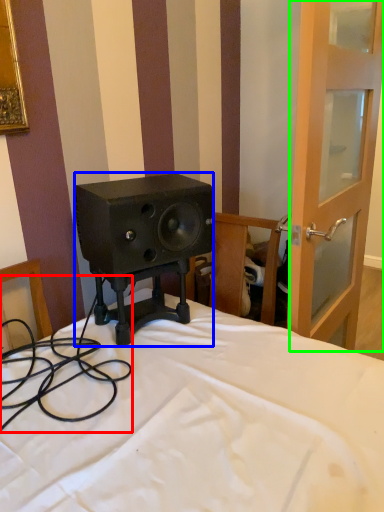
Question: Based on their relative distances, which object is farther from cable (highlighted by a red box)? Choose from loudspeaker (highlighted by a blue box) and screen door (highlighted by a green box).

Choices:
 (A) loudspeaker
 (B) screen door

Answer: (B)